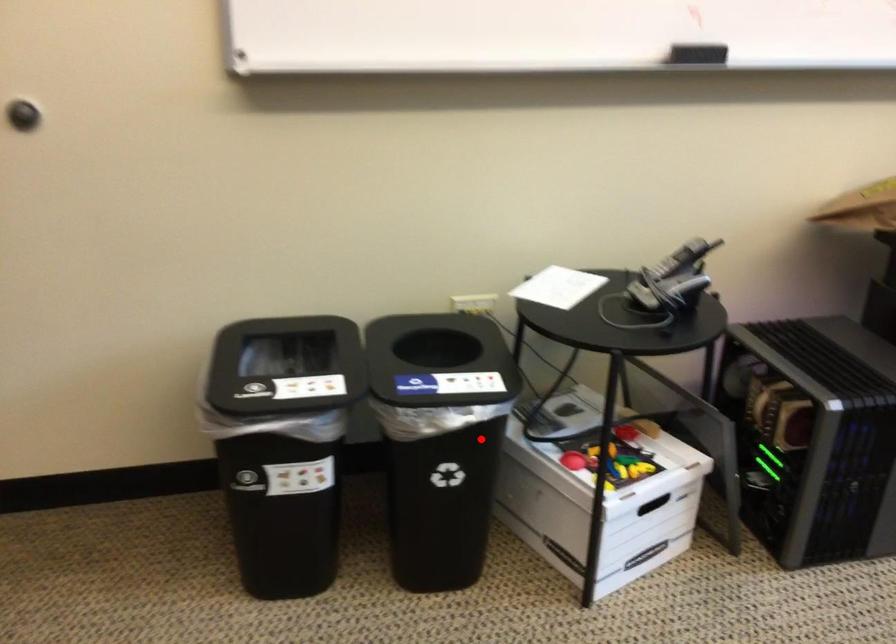
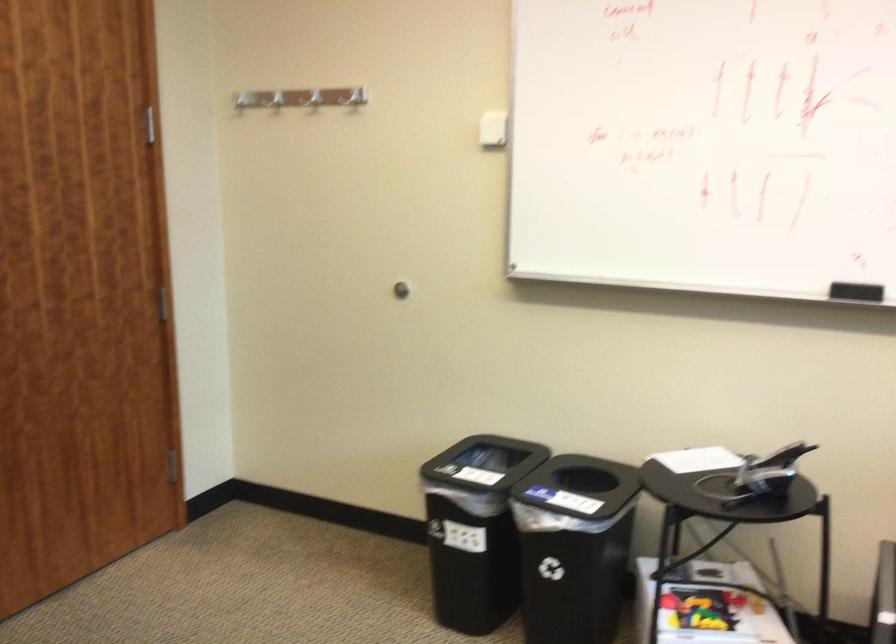
Locate, in the second image, the point that corresponds to the highlighted location in the first image.

(574, 547)